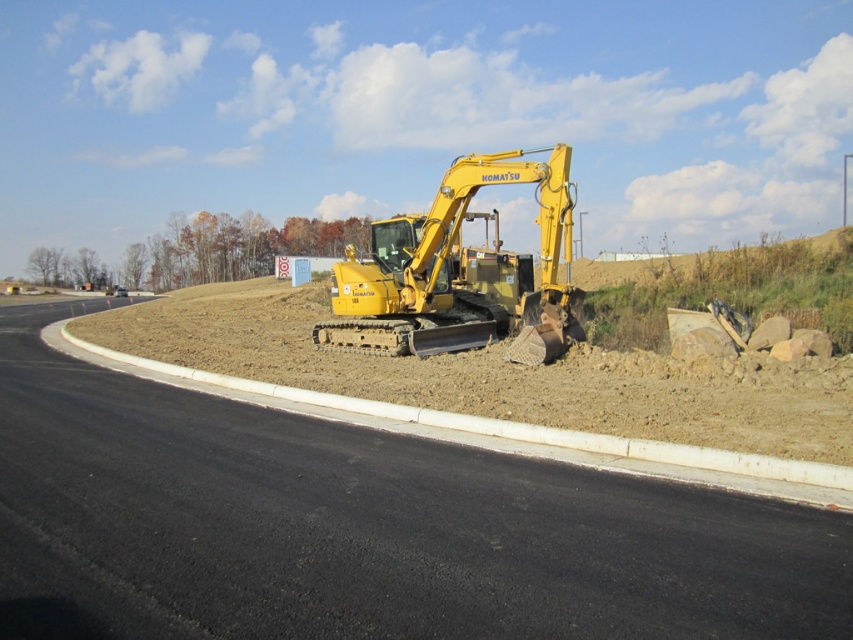
Question: Is black asphalt highway at center to the left of yellow metallic excavator at center from the viewer's perspective?

Choices:
 (A) yes
 (B) no

Answer: (A)

Question: Is black asphalt highway at center bigger than yellow metallic excavator at center?

Choices:
 (A) no
 (B) yes

Answer: (A)

Question: Which point is closer to the camera?

Choices:
 (A) yellow metallic excavator at center
 (B) black asphalt highway at center

Answer: (B)

Question: Which point is farther to the camera?

Choices:
 (A) yellow metallic excavator at center
 (B) black asphalt highway at center

Answer: (A)

Question: Which object is closer to the camera taking this photo?

Choices:
 (A) yellow metallic excavator at center
 (B) black asphalt highway at center

Answer: (B)

Question: Does black asphalt highway at center have a smaller size compared to yellow metallic excavator at center?

Choices:
 (A) no
 (B) yes

Answer: (B)